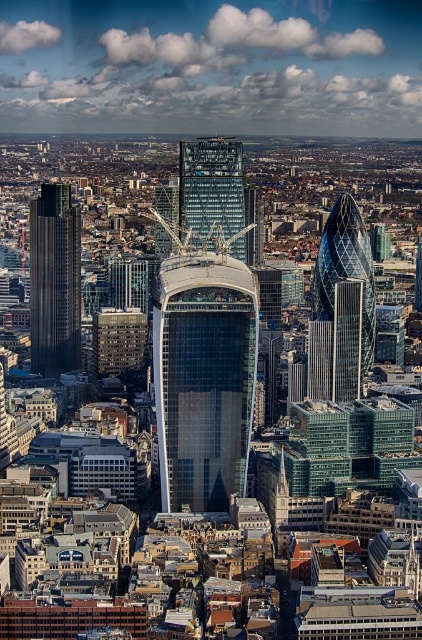
You are a city planner analyzing the skyline. You observe the dark gray glass skyscraper at left and the glassy reflective skyscraper at center. Which one has a larger footprint in terms of base area?

The dark gray glass skyscraper at left is bigger than the glassy reflective skyscraper at center, so it has a larger footprint in terms of base area.

You are a drone operator tasked with capturing aerial footage of the city. You need to position your drone to focus on the dark gray glass skyscraper at left. What are the coordinates where you should direct the drone to ensure it is centered on this building?

The dark gray glass skyscraper at left is located at point (54,282), so you should direct the drone to those coordinates to center it on the building.